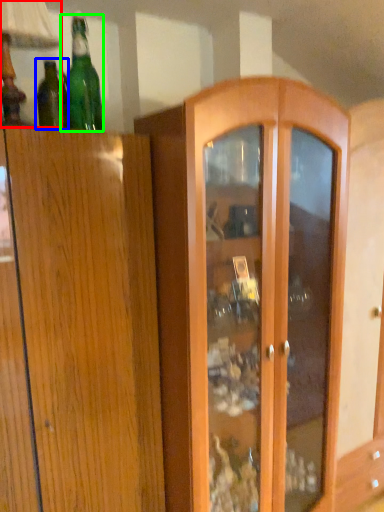
Question: Considering the real-world distances, which object is closest to table lamp (highlighted by a red box)? bottle (highlighted by a blue box) or bottle (highlighted by a green box).

Choices:
 (A) bottle
 (B) bottle

Answer: (B)